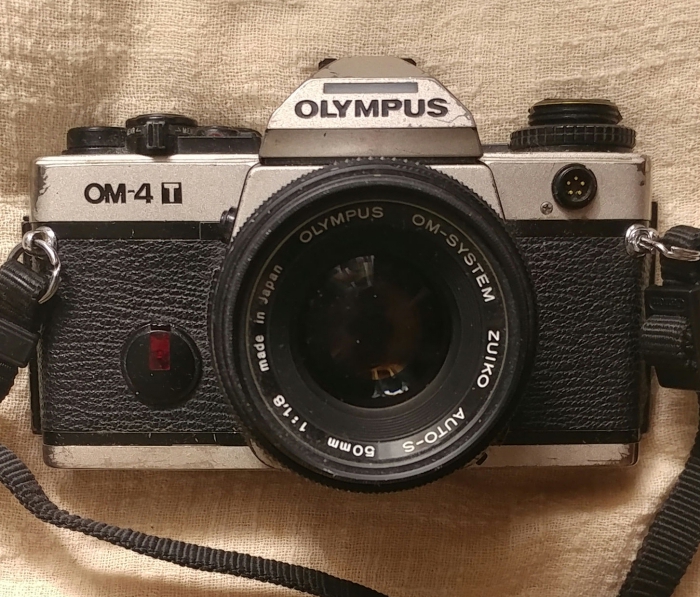
Locate an element on the screen. The image size is (700, 597). hook for strap is located at coordinates (32, 245).